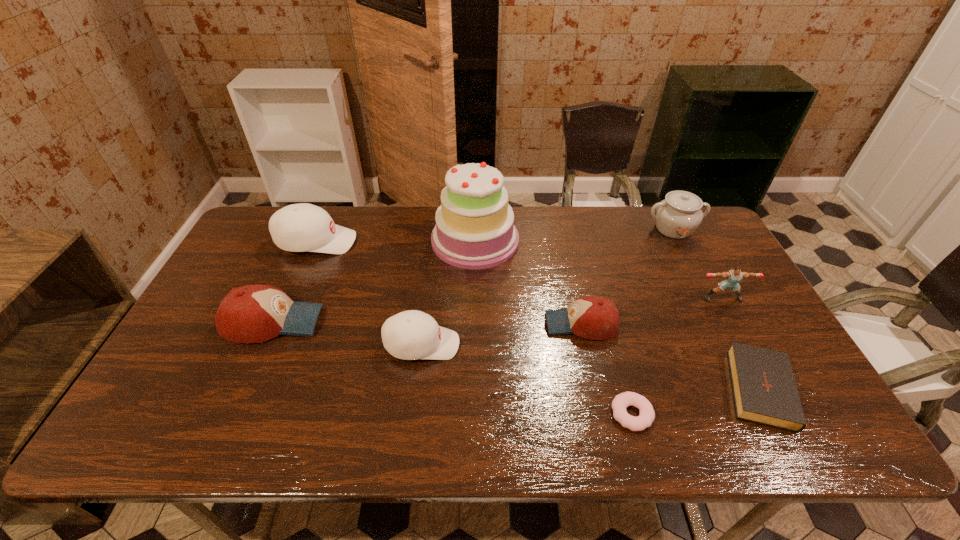
The height and width of the screenshot is (540, 960). What are the coordinates of `free space located on the front-facing side of the rightmost baseball cap` in the screenshot? It's located at (516, 324).

In order to click on vacant point located on the front-facing side of the rightmost baseball cap in this screenshot , I will do `click(446, 324)`.

Locate an element on the screen. The width and height of the screenshot is (960, 540). vacant space located 0.370m on the left of the eighth tallest object is located at coordinates (569, 387).

Find the location of `vacant region located on the back of the shortest object`. vacant region located on the back of the shortest object is located at coordinates (612, 341).

Image resolution: width=960 pixels, height=540 pixels. I want to click on cake located at the far edge, so click(x=474, y=229).

Find the location of a particular element. chinaware located in the far edge section of the desktop is located at coordinates (677, 216).

This screenshot has height=540, width=960. Identify the location of baseball cap that is at the far edge. (302, 227).

You are a GUI agent. You are given a task and a screenshot of the screen. Output one action in this format:
    pyautogui.click(x=<x>, y=<y>)
    Task: Click on the Bible that is at the near edge
    The image size is (960, 540).
    Given the screenshot: What is the action you would take?
    pyautogui.click(x=764, y=389)

This screenshot has width=960, height=540. What are the coordinates of `doughnut that is at the near edge` in the screenshot? It's located at (619, 404).

Find the location of a particular element. The width and height of the screenshot is (960, 540). chinaware that is at the right edge is located at coordinates (677, 216).